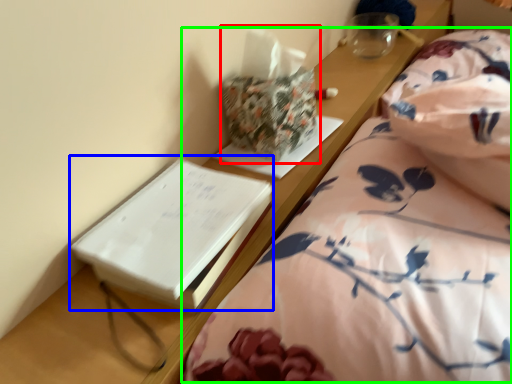
Question: Estimate the real-world distances between objects in this image. Which object is closer to package (highlighted by a red box), paperback book (highlighted by a blue box) or bed (highlighted by a green box)?

Choices:
 (A) paperback book
 (B) bed

Answer: (A)